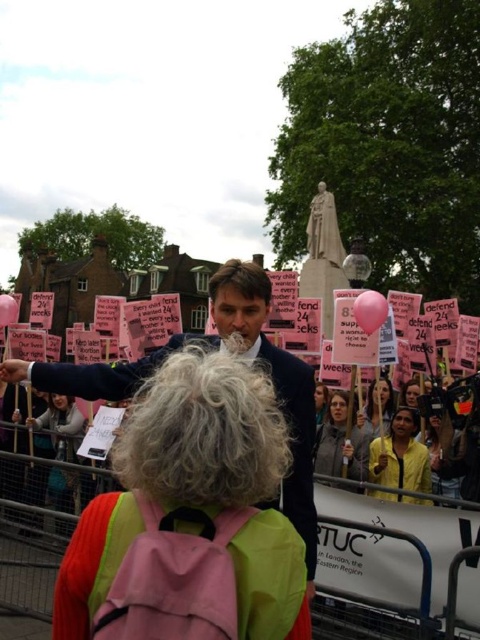
You are a photographer at the protest scene. You want to capture a photo where both the light brown hair at center and the matte gray hoodie at center are clearly visible. Considering their sizes, which object should you focus on to ensure both are in frame?

Since the light brown hair at center is larger in size than the matte gray hoodie at center, you should focus on the light brown hair at center to ensure both are in frame as it takes up more space and will help frame the composition.

You are standing at the point marked as point (44, 422) and want to take a photo of the central figure in the scene. Given that the camera is 55.55 meters away from your current position, will you be able to capture the central figure in the photo without moving?

The camera is 55.55 meters away from the point (44, 422), so you will need to move closer to capture the central figure in the photo as the distance is too far.

You are a photographer standing at the center of the scene. You want to take a photo that includes the light brown hair at center. What is the best direction to aim your camera?

The light brown hair at center is located at point 0.667 on the x axis and 0.129 on the y axis, so you should aim your camera to the right and slightly downward to capture it.